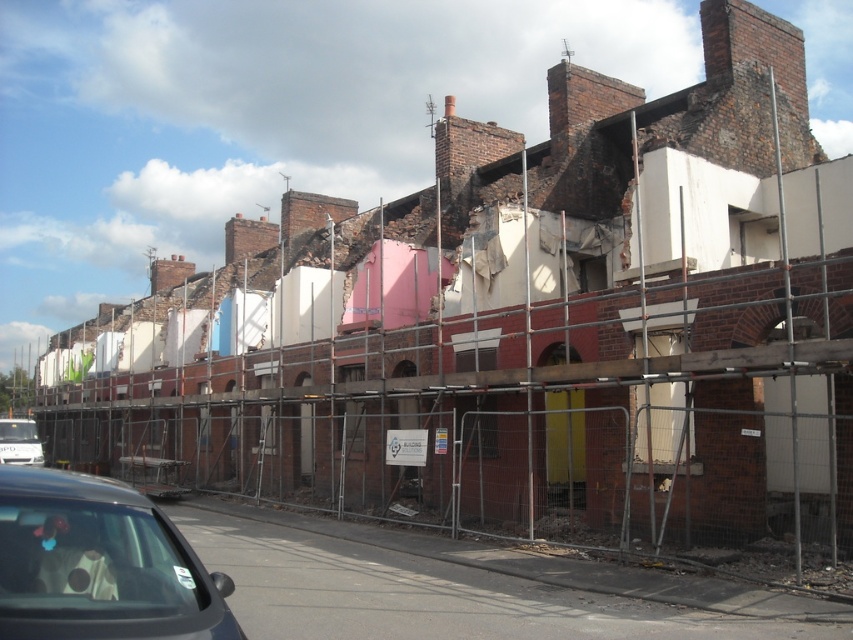
You are a pedestrian walking along the street and notice a black glossy car at lower left and a white matte van at lower left. Which vehicle is positioned more to the right side?

The black glossy car at lower left is positioned more to the right side than the white matte van at lower left.

In the scene shown: You are a delivery driver who needs to park your vehicle in the area shown. You have a black glossy car at lower left and a white matte van at lower left. Which vehicle requires more space to park?

The white matte van at lower left requires more space to park because it is larger than the black glossy car at lower left.